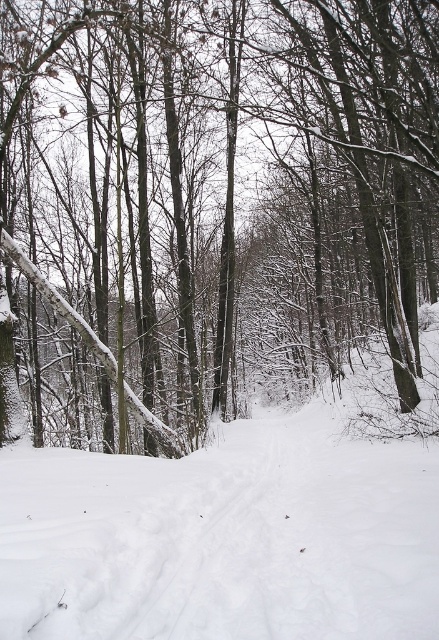
Does snow-covered tree at center have a larger size compared to white powdery snow at center?

Correct, snow-covered tree at center is larger in size than white powdery snow at center.

Who is shorter, snow-covered tree at center or white powdery snow at center?

white powdery snow at center

Is point (360, 269) farther from viewer compared to point (364, 616)?

Yes, it is.

Find the location of a particular element. snow-covered tree at center is located at coordinates (218, 196).